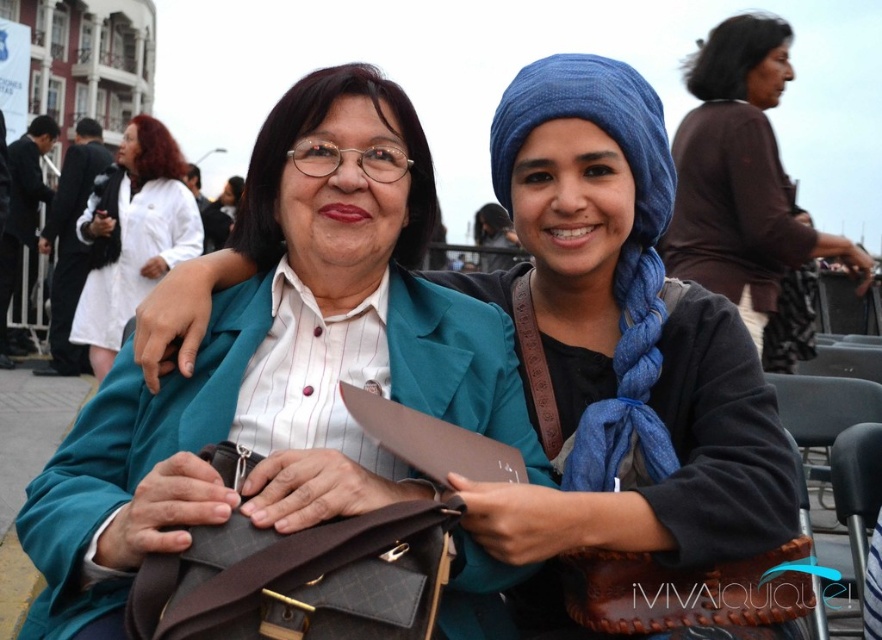
Can you confirm if matte teal blazer at center is smaller than blue fabric headscarf at center?

No, matte teal blazer at center is not smaller than blue fabric headscarf at center.

Is point (540, 618) positioned behind point (641, 202)?

That is False.

You are a GUI agent. You are given a task and a screenshot of the screen. Output one action in this format:
    pyautogui.click(x=<x>, y=<y>)
    Task: Click on the matte teal blazer at center
    
    Given the screenshot: What is the action you would take?
    point(619,342)

Does blue fabric headscarf at center have a greater height compared to white smooth coat at upper left?

Incorrect, blue fabric headscarf at center's height is not larger of white smooth coat at upper left's.

Which is above, blue fabric headscarf at center or white smooth coat at upper left?

white smooth coat at upper left is higher up.

Where is `blue fabric headscarf at center`? This screenshot has height=640, width=882. blue fabric headscarf at center is located at coordinates [x=618, y=253].

Is matte teal blazer at center behind white smooth coat at upper left?

No, matte teal blazer at center is in front of white smooth coat at upper left.

Who is higher up, matte teal blazer at center or white smooth coat at upper left?

white smooth coat at upper left

Locate an element on the screen. This screenshot has height=640, width=882. matte teal blazer at center is located at coordinates (619, 342).